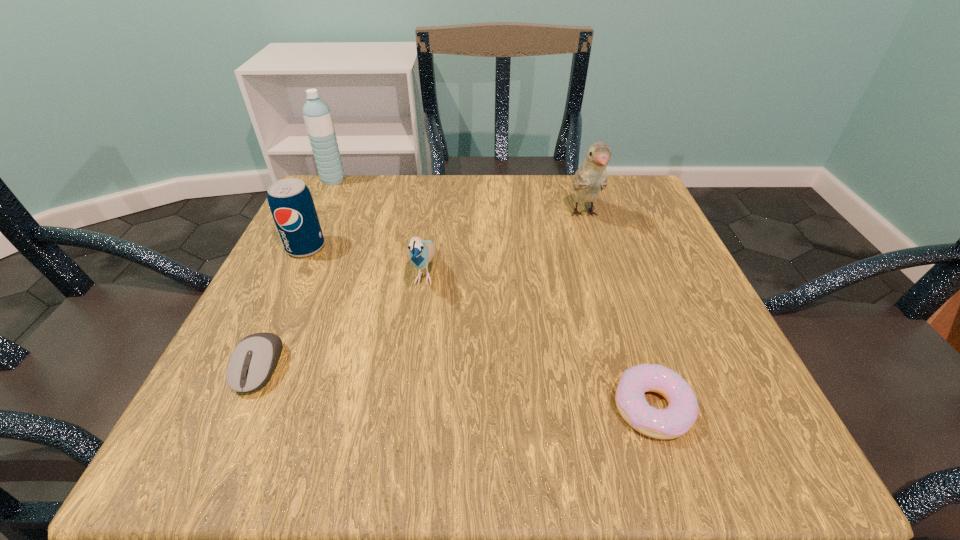
The width and height of the screenshot is (960, 540). What are the coordinates of `blank space at the far left corner of the desktop` in the screenshot? It's located at (328, 223).

Locate an element on the screen. This screenshot has width=960, height=540. vacant region at the near left corner is located at coordinates (184, 431).

In the image, there is a desktop. At what (x,y) coordinates should I click in order to perform the action: click on vacant region at the far right corner. Please return your answer as a coordinate pair (x, y). The image size is (960, 540). Looking at the image, I should click on (604, 199).

Identify the location of vacant region at the near right corner of the desktop. [766, 412].

Where is `vacant point located between the pop and the doughnut`? Image resolution: width=960 pixels, height=540 pixels. vacant point located between the pop and the doughnut is located at coordinates (479, 327).

The image size is (960, 540). Find the location of `blank region between the pop and the computer equipment`. blank region between the pop and the computer equipment is located at coordinates (x=282, y=307).

I want to click on vacant space that's between the water bottle and the pop, so click(320, 214).

Where is `free space between the computer equipment and the farthest object`? free space between the computer equipment and the farthest object is located at coordinates (297, 274).

At what (x,y) coordinates should I click in order to perform the action: click on free space between the pop and the left bird. Please return your answer as a coordinate pair (x, y). The width and height of the screenshot is (960, 540). Looking at the image, I should click on (365, 260).

Locate an element on the screen. This screenshot has width=960, height=540. free space between the taller bird and the tallest object is located at coordinates (459, 198).